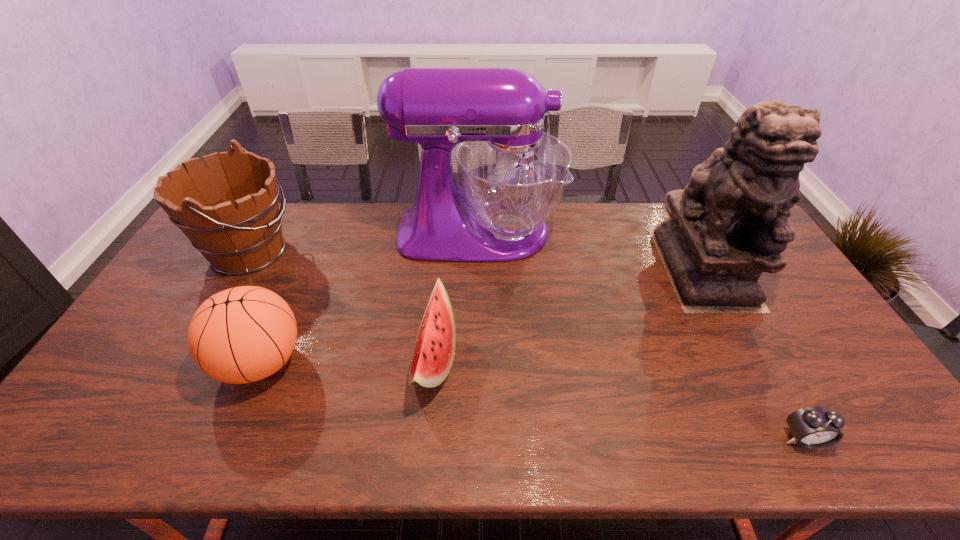
Locate an element on the screen. The image size is (960, 540). mixer is located at coordinates (512, 175).

You are a GUI agent. You are given a task and a screenshot of the screen. Output one action in this format:
    pyautogui.click(x=<x>, y=<y>)
    Task: Click on the sculpture
    The image size is (960, 540).
    Given the screenshot: What is the action you would take?
    pyautogui.click(x=730, y=223)

Find the location of a particular element. This screenshot has width=960, height=540. the fourth shortest object is located at coordinates (229, 211).

Locate an element on the screen. This screenshot has height=540, width=960. the fourth tallest object is located at coordinates (244, 334).

Locate an element on the screen. The height and width of the screenshot is (540, 960). watermelon is located at coordinates (434, 350).

You are a GUI agent. You are given a task and a screenshot of the screen. Output one action in this format:
    pyautogui.click(x=<x>, y=<y>)
    Task: Click on the shortest object
    Image resolution: width=960 pixels, height=540 pixels.
    Given the screenshot: What is the action you would take?
    pyautogui.click(x=815, y=427)

Locate an element on the screen. Image resolution: width=960 pixels, height=540 pixels. alarm clock is located at coordinates (815, 427).

You are a GUI agent. You are given a task and a screenshot of the screen. Output one action in this format:
    pyautogui.click(x=<x>, y=<y>)
    Task: Click on the free space located at the bowl opening of the mixer
    The height and width of the screenshot is (540, 960).
    Given the screenshot: What is the action you would take?
    pyautogui.click(x=656, y=232)

Identify the location of vacant space positioned 0.090m on the front-facing side of the sculpture. (741, 339).

Find the location of a particular element. The image size is (960, 540). free space located 0.320m with the handle on the wine bucket is located at coordinates (394, 252).